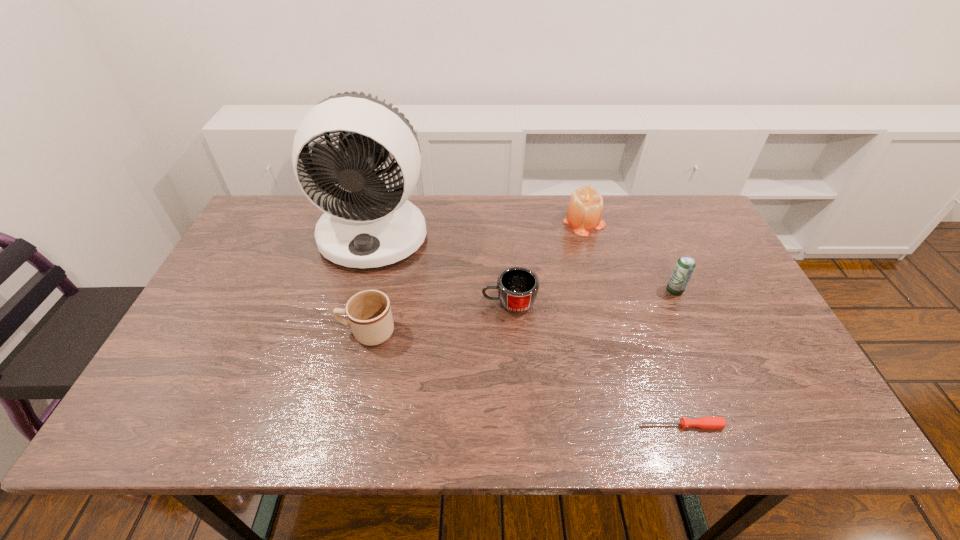
At what (x,y) coordinates should I click in order to perform the action: click on vacant space situated on the back of the beer can. Please return your answer as a coordinate pair (x, y). Image resolution: width=960 pixels, height=540 pixels. Looking at the image, I should click on 641,213.

Locate an element on the screen. This screenshot has width=960, height=540. free spot located on the side of the taller mug with the handle is located at coordinates (274, 332).

Locate an element on the screen. vacant area situated 0.270m on the side of the taller mug with the handle is located at coordinates (234, 332).

This screenshot has height=540, width=960. Identify the location of blank space located 0.290m on the side of the taller mug with the handle. (227, 332).

Identify the location of vacant area situated on the side of the fifth tallest object with the handle. This screenshot has width=960, height=540. (407, 303).

Image resolution: width=960 pixels, height=540 pixels. Identify the location of free space located 0.180m on the side of the fifth tallest object with the handle. (415, 303).

Where is `blank space located 0.080m on the side of the fifth tallest object with the handle`? The width and height of the screenshot is (960, 540). blank space located 0.080m on the side of the fifth tallest object with the handle is located at coordinates (452, 303).

Where is `vacant position located 0.080m at the tip of the shortest object`? vacant position located 0.080m at the tip of the shortest object is located at coordinates (603, 426).

Locate an element on the screen. The image size is (960, 540). vacant space located 0.250m at the tip of the shortest object is located at coordinates (523, 426).

This screenshot has height=540, width=960. Find the location of `vacant space located at the tip of the shortest object`. vacant space located at the tip of the shortest object is located at coordinates (569, 426).